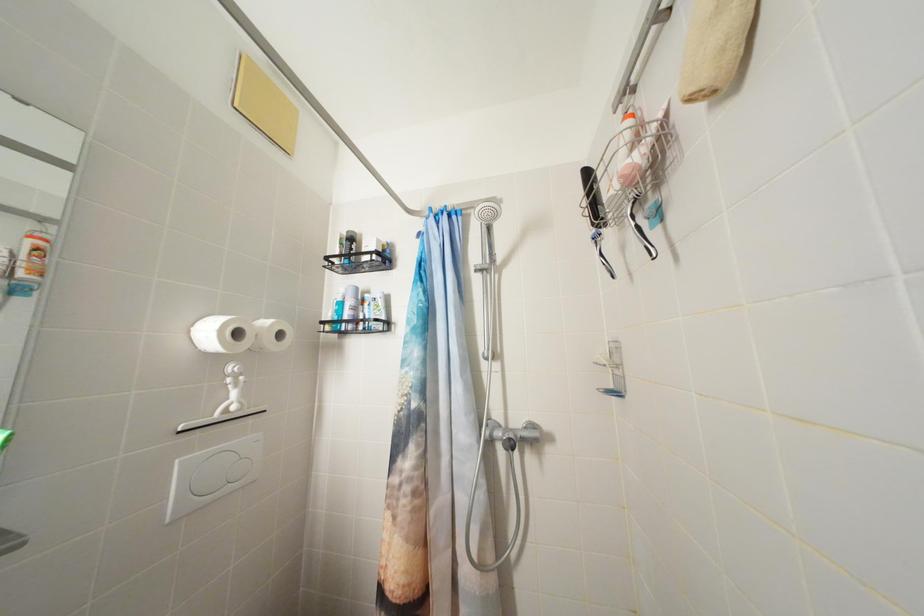
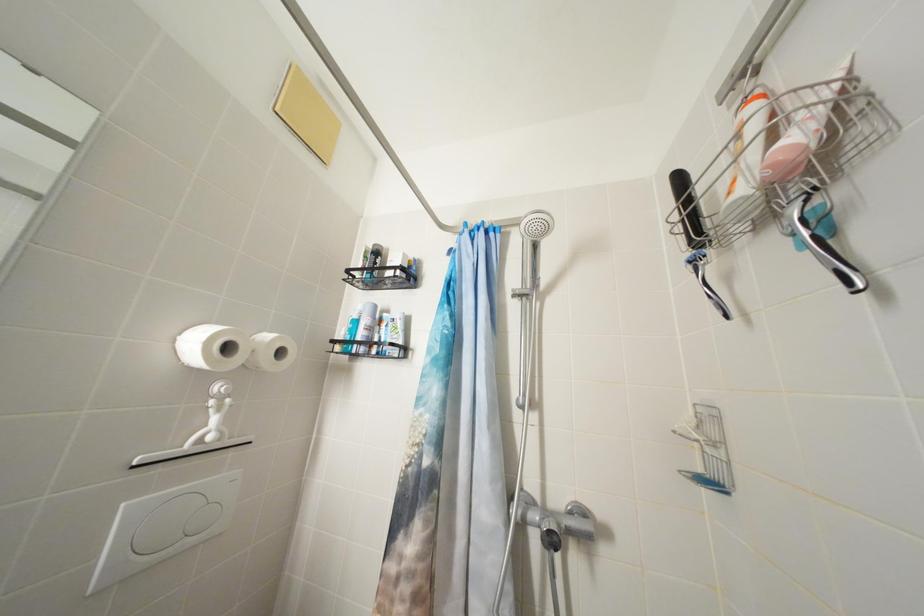
Question: In a continuous first-person perspective shot, in which direction is the camera moving?

Choices:
 (A) Left
 (B) Right
 (C) Forward
 (D) Backward

Answer: (C)